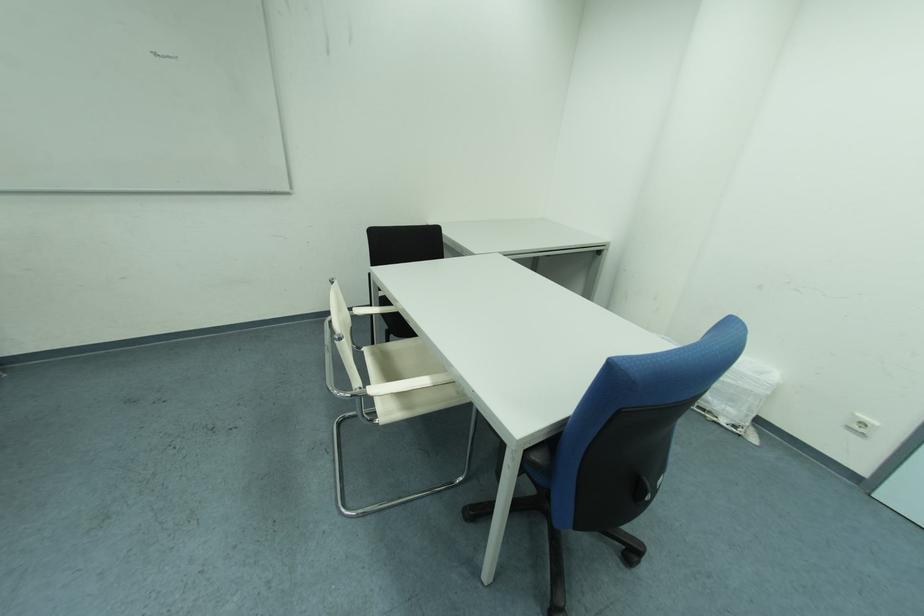
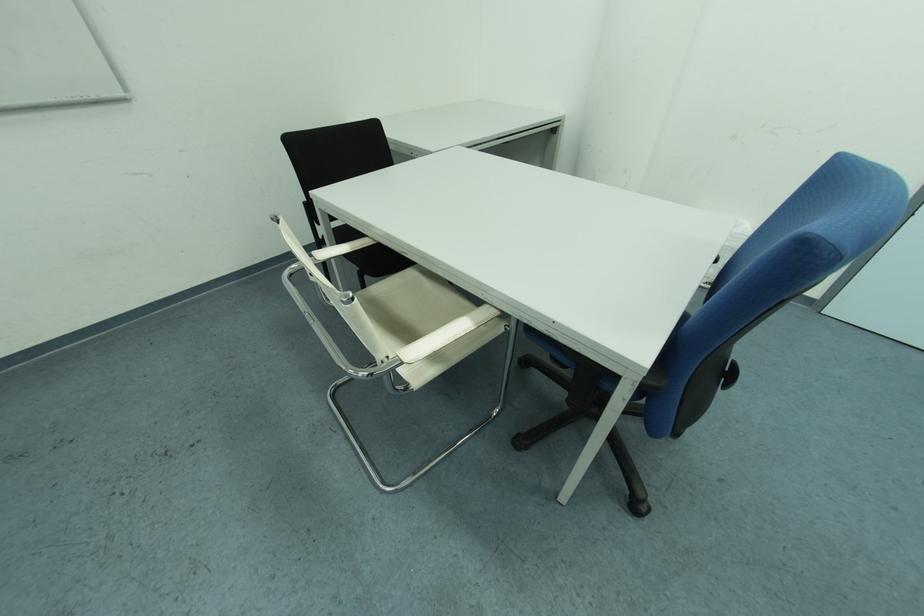
Question: The images are taken continuously from a first-person perspective. In which direction is your viewpoint rotating?

Choices:
 (A) Left
 (B) Right
 (C) Up
 (D) Down

Answer: (D)